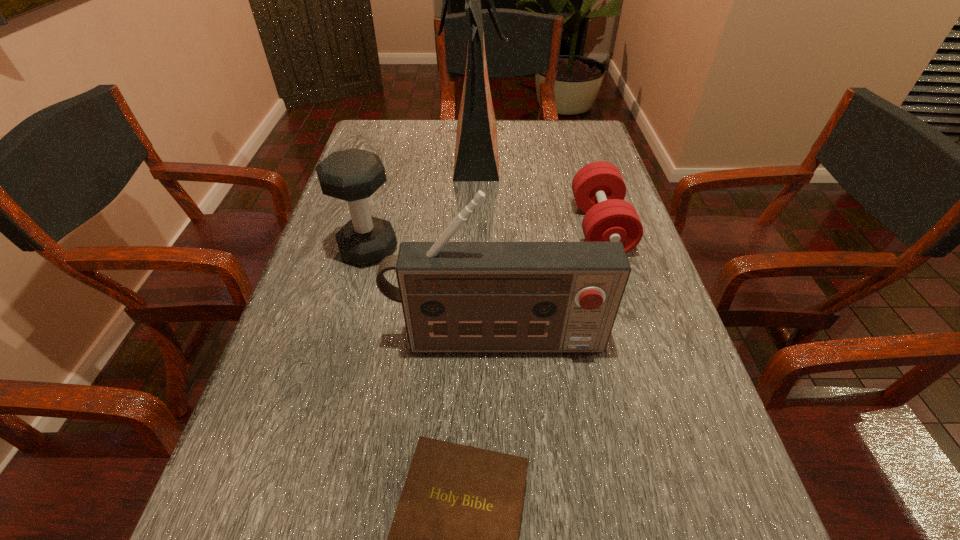
Where is `free region at the far right corner`? This screenshot has width=960, height=540. free region at the far right corner is located at coordinates (553, 152).

I want to click on free area in between the shorter dumbbell and the left dumbbell, so click(484, 239).

Find the location of `free space between the farthest object and the right dumbbell`. free space between the farthest object and the right dumbbell is located at coordinates (x=537, y=191).

Locate which object is the closest to the shopping bag. Please provide its 2D coordinates. Your answer should be formatted as a tuple, i.e. [(x, y)], where the tuple contains the x and y coordinates of a point satisfying the conditions above.

[(599, 190)]

Find the location of `object that is the third closest to the farthest object`. object that is the third closest to the farthest object is located at coordinates (456, 296).

Locate an element on the screen. The height and width of the screenshot is (540, 960). free space that satisfies the following two spatial constraints: 1. on the front side of the right dumbbell; 2. on the left side of the tallest object is located at coordinates (472, 228).

The width and height of the screenshot is (960, 540). I want to click on blank area in the image that satisfies the following two spatial constraints: 1. on the front side of the farthest object; 2. on the left side of the right dumbbell, so click(472, 228).